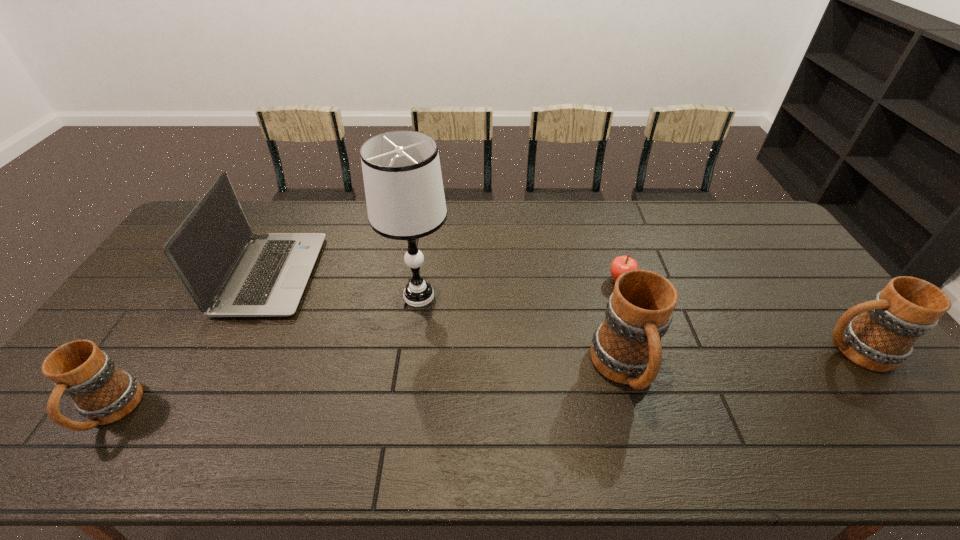
Locate an element on the screen. vacant position at the right edge of the desktop is located at coordinates pyautogui.click(x=787, y=303).

Identify the location of free spot at the far right corner of the desktop. Image resolution: width=960 pixels, height=540 pixels. (767, 225).

Image resolution: width=960 pixels, height=540 pixels. I want to click on free space between the leftmost object and the apple, so click(x=366, y=346).

The height and width of the screenshot is (540, 960). Identify the location of vacant space that's between the fourth object from right to left and the shortest object. (520, 288).

What are the coordinates of `vacant region between the laptop computer and the apple` in the screenshot? It's located at (446, 278).

Identify the location of blank region between the third object from left to right and the second mug from left to right. (522, 333).

I want to click on vacant point located between the second tallest mug and the shortest object, so click(x=737, y=315).

I want to click on vacant space in between the second mug from right to left and the shortest mug, so click(368, 391).

This screenshot has height=540, width=960. I want to click on vacant area that lies between the fourth tallest object and the second mug from right to left, so click(739, 360).

This screenshot has height=540, width=960. Identify the location of vacant point located between the fourth object from right to left and the apple. (520, 288).